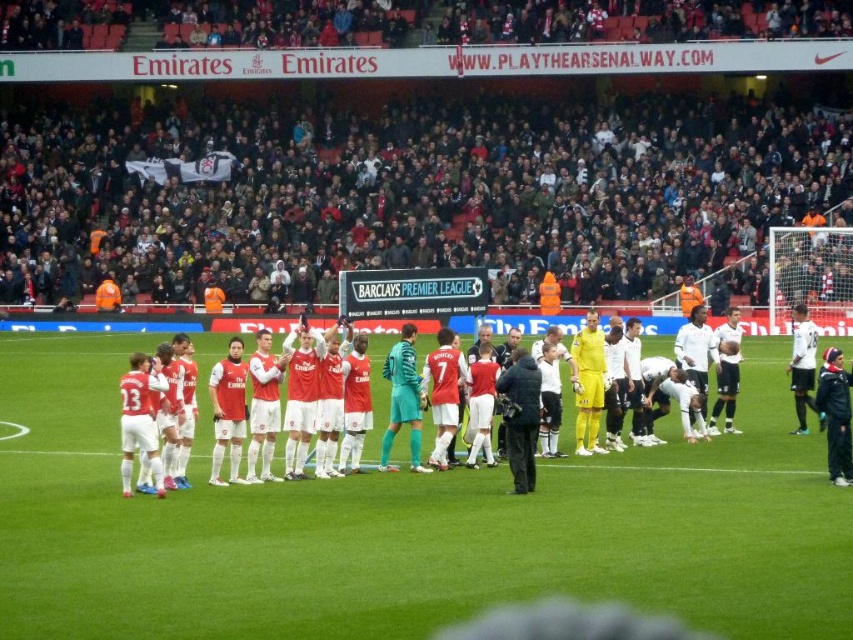
Is the position of green grass field at center less distant than that of dark gray crowd at upper center?

Yes, green grass field at center is in front of dark gray crowd at upper center.

Who is more distant from viewer, (683, 612) or (550, 116)?

Point (550, 116)

Does point (47, 502) come in front of point (486, 152)?

Yes, point (47, 502) is closer to viewer.

The image size is (853, 640). I want to click on green grass field at center, so click(x=404, y=525).

Can you confirm if matte red jersey at center is positioned to the left of black fabric camera at center?

Yes, matte red jersey at center is to the left of black fabric camera at center.

Measure the distance between matte red jersey at center and camera.

matte red jersey at center is 16.93 meters away from camera.

Which is in front, point (322, 435) or point (538, 404)?

Positioned in front is point (538, 404).

At what (x,y) coordinates should I click in order to perform the action: click on matte red jersey at center. Please return your answer as a coordinate pair (x, y). The image size is (853, 640). Looking at the image, I should click on (306, 372).

Is dark gray crowd at upper center thinner than matte red jersey at center?

No.

Who is more distant from viewer, [315,180] or [814,360]?

The point [315,180] is more distant.

At what (x,y) coordinates should I click in order to perform the action: click on dark gray crowd at upper center. Please return your answer as a coordinate pair (x, y). Image resolution: width=853 pixels, height=640 pixels. Looking at the image, I should click on (405, 193).